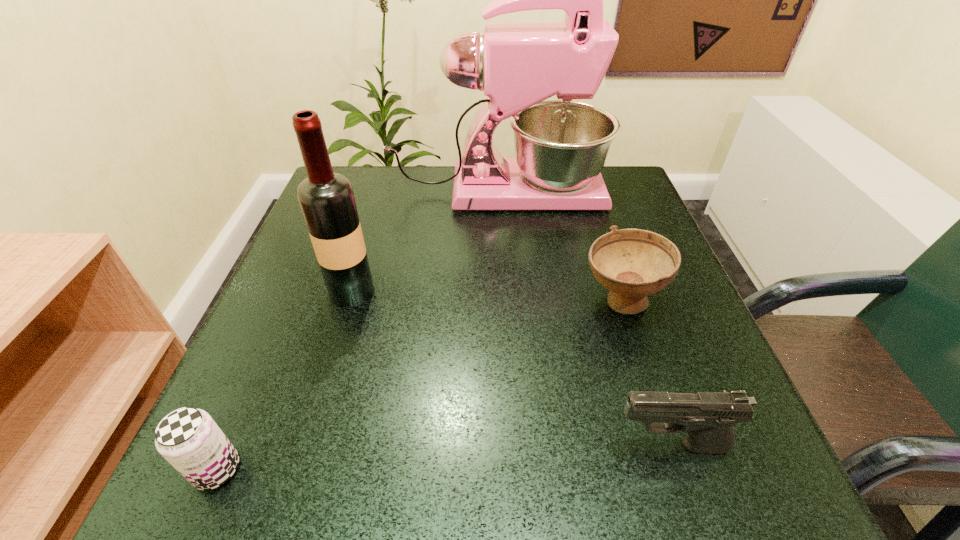
I want to click on free location located at the barrel of the pistol, so click(576, 446).

Find the location of `vacant space situated 0.160m at the barrel of the pistol`. vacant space situated 0.160m at the barrel of the pistol is located at coordinates (496, 446).

At what (x,y) coordinates should I click in order to perform the action: click on vacant space situated 0.070m on the right of the beer can. Please return your answer as a coordinate pair (x, y). Looking at the image, I should click on (292, 469).

Locate an element on the screen. object present at the far edge is located at coordinates (561, 146).

The height and width of the screenshot is (540, 960). Identify the location of pistol that is positioned at the near edge. (708, 417).

Locate an element on the screen. beer can positioned at the near edge is located at coordinates (x=189, y=439).

Locate an element on the screen. Image resolution: width=960 pixels, height=540 pixels. mixer that is at the left edge is located at coordinates (561, 146).

Locate an element on the screen. The width and height of the screenshot is (960, 540). wine bottle that is at the left edge is located at coordinates (327, 201).

Identify the location of beer can at the left edge. This screenshot has width=960, height=540. (189, 439).

This screenshot has width=960, height=540. I want to click on mixer that is at the right edge, so click(561, 146).